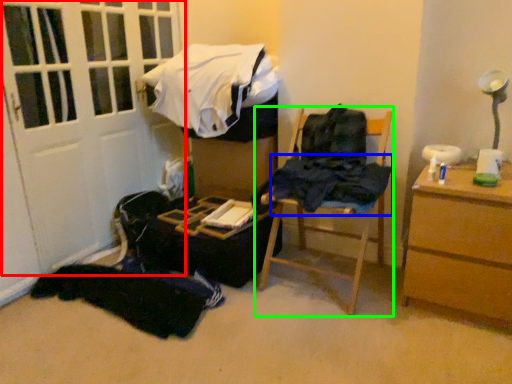
Question: Considering the real-world distances, which object is closest to door (highlighted by a red box)? clothing (highlighted by a blue box) or furniture (highlighted by a green box).

Choices:
 (A) clothing
 (B) furniture

Answer: (B)